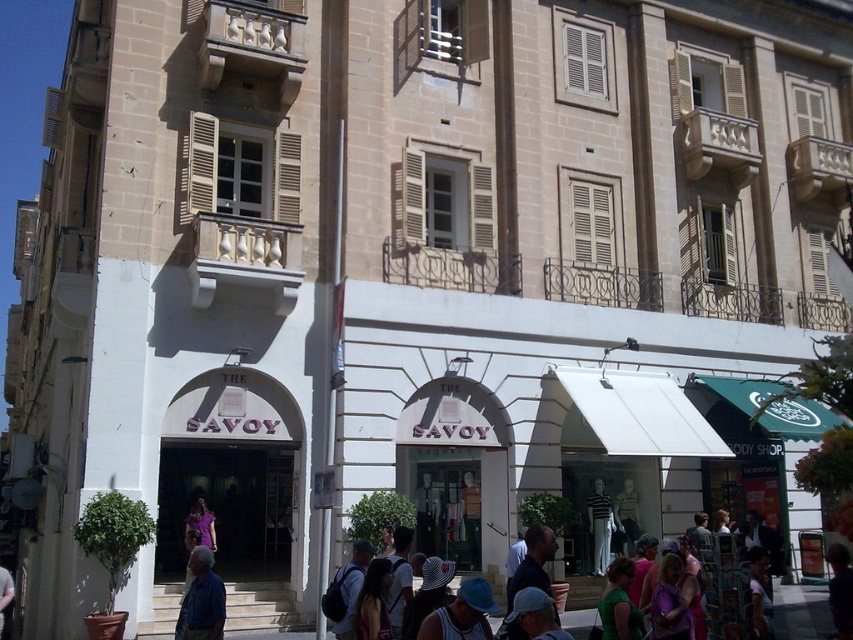
Question: Considering the real-world distances, which object is farthest from the blue fabric shirt at lower left?

Choices:
 (A) blue fabric cap at center
 (B) matte blue hat at lower center
 (C) matte white crowd at center

Answer: (C)

Question: Does blue fabric shirt at lower left have a larger size compared to matte blue hat at lower center?

Choices:
 (A) no
 (B) yes

Answer: (A)

Question: Among these points, which one is nearest to the camera?

Choices:
 (A) (515, 600)
 (B) (207, 552)
 (C) (700, 564)
 (D) (476, 588)

Answer: (A)

Question: Can you confirm if matte blue hat at lower center is wider than blue fabric cap at center?

Choices:
 (A) no
 (B) yes

Answer: (B)

Question: Which point is closer to the camera?

Choices:
 (A) blue fabric shirt at lower left
 (B) blue fabric cap at center

Answer: (B)

Question: Is matte blue hat at lower center below blue fabric cap at center?

Choices:
 (A) no
 (B) yes

Answer: (B)